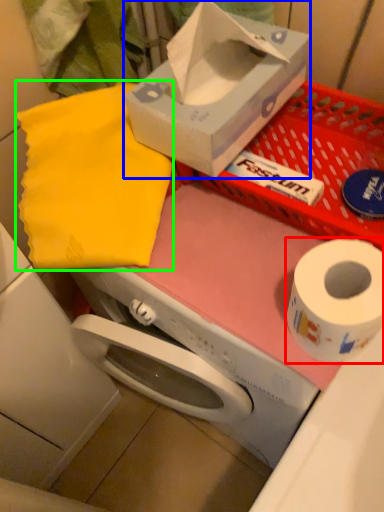
Question: Which object is the closest to the toilet paper (highlighted by a red box)? Choose among these: box (highlighted by a blue box) or cloth (highlighted by a green box).

Choices:
 (A) box
 (B) cloth

Answer: (A)